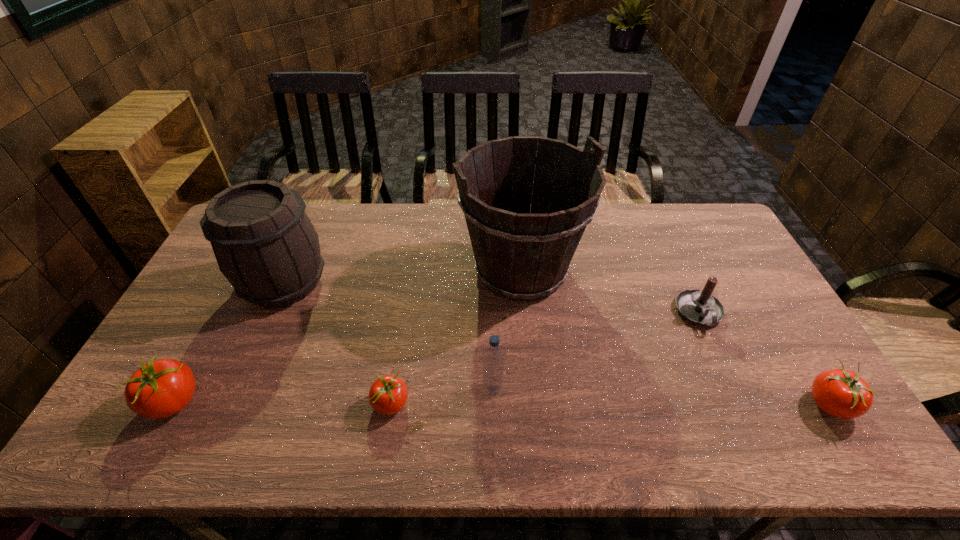
The image size is (960, 540). I want to click on tomato located at the right edge, so click(x=841, y=393).

What are the coordinates of `candle that is at the right edge` in the screenshot? It's located at (700, 307).

I want to click on object situated at the near left corner, so click(159, 389).

The height and width of the screenshot is (540, 960). I want to click on object that is positioned at the near right corner, so click(x=841, y=393).

Where is `free spot at the far edge of the desktop`? free spot at the far edge of the desktop is located at coordinates (389, 235).

In the image, there is a desktop. At what (x,y) coordinates should I click in order to perform the action: click on vacant region at the near edge. Please return your answer as a coordinate pair (x, y). Looking at the image, I should click on (729, 401).

Locate an element on the screen. This screenshot has height=540, width=960. free space at the left edge is located at coordinates (184, 352).

I want to click on vacant area at the right edge of the desktop, so click(721, 256).

In the image, there is a desktop. Identify the location of vacant space at the far right corner. (691, 237).

You are a GUI agent. You are given a task and a screenshot of the screen. Output one action in this format:
    pyautogui.click(x=<x>, y=<y>)
    Task: Click on the empty space that is in between the third tallest object and the tallest tomato
    The image size is (960, 540).
    Given the screenshot: What is the action you would take?
    pyautogui.click(x=333, y=396)